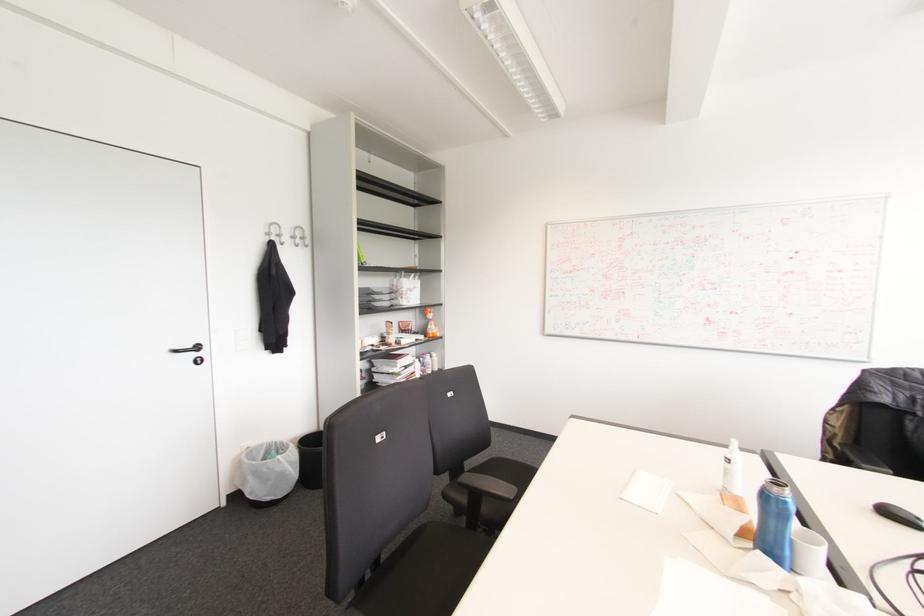
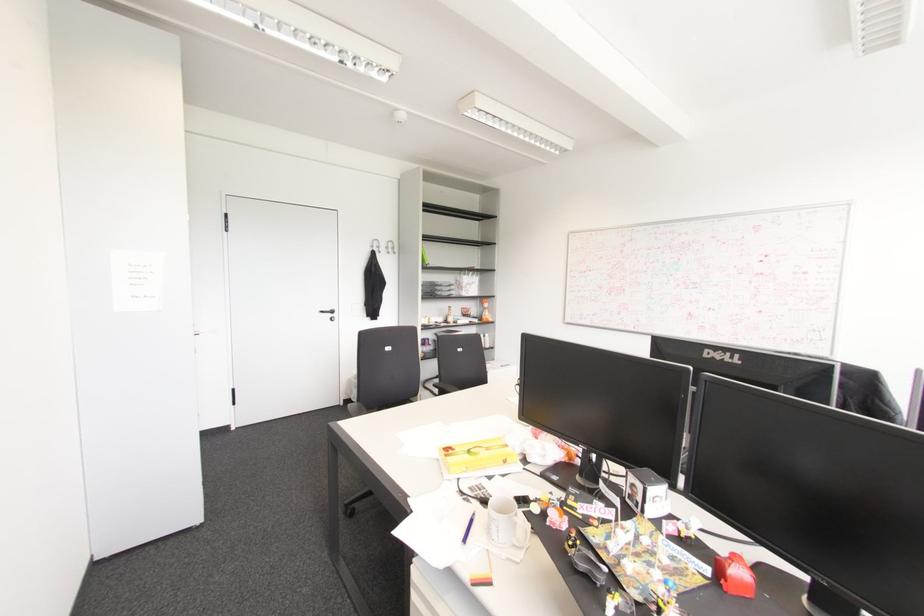
Locate, in the second image, the point that corresponds to pixel 301 238 in the first image.

(392, 248)